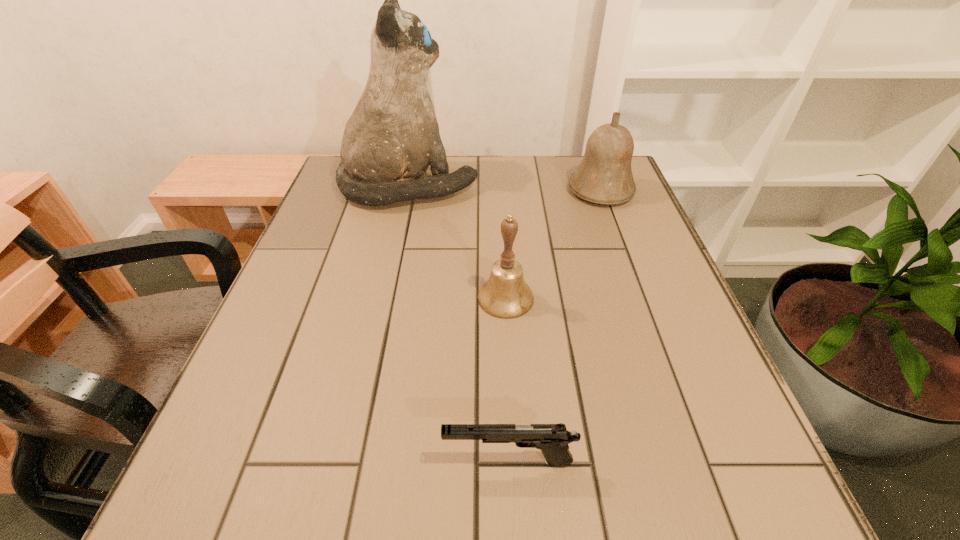
Locate an element on the screen. The width and height of the screenshot is (960, 540). vacant space at the near edge of the desktop is located at coordinates (603, 502).

You are a GUI agent. You are given a task and a screenshot of the screen. Output one action in this format:
    pyautogui.click(x=<x>, y=<y>)
    Task: Click on the vacant space at the left edge of the desktop
    This screenshot has height=540, width=960.
    Given the screenshot: What is the action you would take?
    pyautogui.click(x=345, y=339)

At what (x,y) coordinates should I click in order to perform the action: click on vacant position at the right edge of the desktop. Please return your answer as a coordinate pair (x, y). Looking at the image, I should click on (595, 242).

I want to click on vacant space at the near left corner, so click(264, 533).

Identify the location of free space at the near right corner of the desktop. (673, 515).

The image size is (960, 540). Identify the location of free space between the rightmost object and the cat. (505, 188).

This screenshot has height=540, width=960. Find the location of `vacant space in between the second nearest object and the right bell`. vacant space in between the second nearest object and the right bell is located at coordinates click(553, 244).

The image size is (960, 540). I want to click on free spot between the cat and the nearest object, so click(459, 323).

Where is `unoccupied area between the tallest object and the shortest object`? The height and width of the screenshot is (540, 960). unoccupied area between the tallest object and the shortest object is located at coordinates (459, 323).

Locate an element on the screen. The height and width of the screenshot is (540, 960). free space between the gun and the cat is located at coordinates (459, 323).